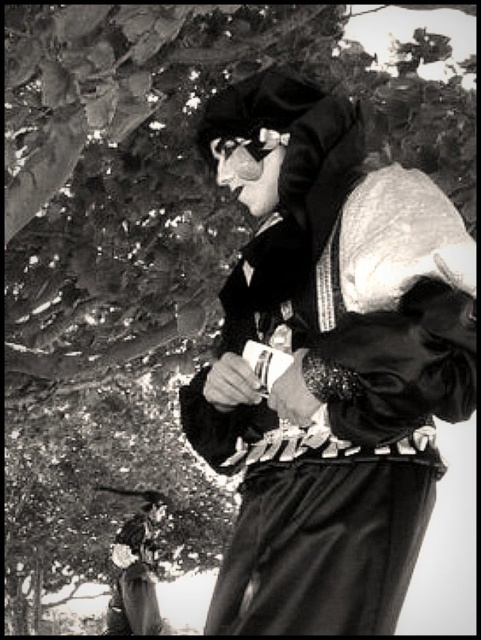
Question: Which object is positioned farthest from the velvet black hat at lower left?

Choices:
 (A) metallic reflective goggles at center
 (B) velvet black mask at center

Answer: (B)

Question: Can you confirm if velvet black hat at lower left is positioned to the left of metallic reflective goggles at center?

Choices:
 (A) no
 (B) yes

Answer: (B)

Question: Is velvet black hat at lower left smaller than metallic reflective goggles at center?

Choices:
 (A) yes
 (B) no

Answer: (B)

Question: Which point is farther from the camera taking this photo?

Choices:
 (A) (413, 285)
 (B) (227, 168)

Answer: (B)

Question: Which object is the farthest from the metallic reflective goggles at center?

Choices:
 (A) velvet black mask at center
 (B) velvet black hat at lower left

Answer: (B)

Question: Does velvet black mask at center have a greater width compared to velvet black hat at lower left?

Choices:
 (A) no
 (B) yes

Answer: (A)